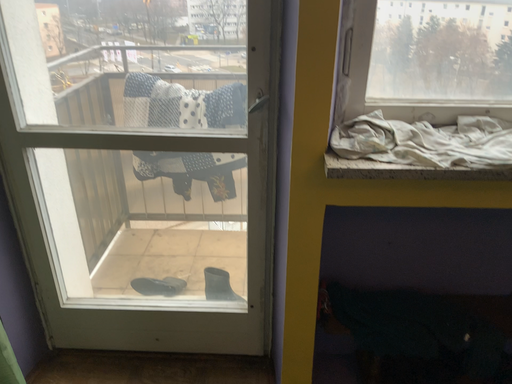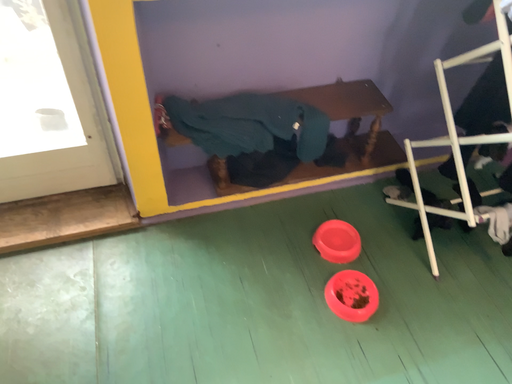
Question: How did the camera likely rotate when shooting the video?

Choices:
 (A) rotated downward
 (B) rotated upward

Answer: (A)